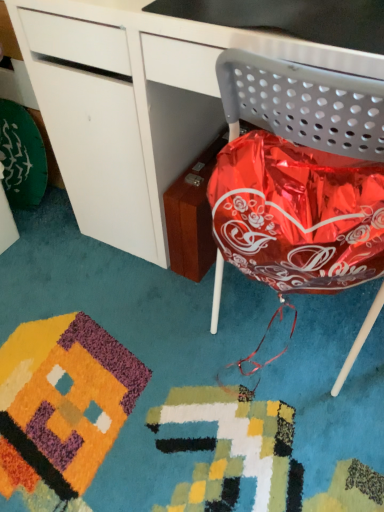
Question: Would you say glossy white desk at center is part of metallic gray chair at right's contents?

Choices:
 (A) yes
 (B) no

Answer: (B)

Question: Does metallic gray chair at right have a greater height compared to glossy white desk at center?

Choices:
 (A) yes
 (B) no

Answer: (B)

Question: Does metallic gray chair at right have a smaller size compared to glossy white desk at center?

Choices:
 (A) yes
 (B) no

Answer: (A)

Question: Is glossy white desk at center at the back of metallic gray chair at right?

Choices:
 (A) yes
 (B) no

Answer: (A)

Question: Is metallic gray chair at right not inside glossy white desk at center?

Choices:
 (A) no
 (B) yes

Answer: (A)

Question: Is there a large distance between metallic gray chair at right and glossy white desk at center?

Choices:
 (A) yes
 (B) no

Answer: (B)

Question: Are glossy white desk at center and metallic gray chair at right located far from each other?

Choices:
 (A) no
 (B) yes

Answer: (A)

Question: Does glossy white desk at center appear on the right side of metallic gray chair at right?

Choices:
 (A) no
 (B) yes

Answer: (A)

Question: Can you confirm if glossy white desk at center is taller than metallic gray chair at right?

Choices:
 (A) yes
 (B) no

Answer: (A)

Question: Is glossy white desk at center bigger than metallic gray chair at right?

Choices:
 (A) yes
 (B) no

Answer: (A)

Question: Is glossy white desk at center thinner than metallic gray chair at right?

Choices:
 (A) yes
 (B) no

Answer: (B)

Question: From the image's perspective, is glossy white desk at center located beneath metallic gray chair at right?

Choices:
 (A) yes
 (B) no

Answer: (B)

Question: From a real-world perspective, relative to glossy white desk at center, is metallic gray chair at right vertically above or below?

Choices:
 (A) above
 (B) below

Answer: (A)